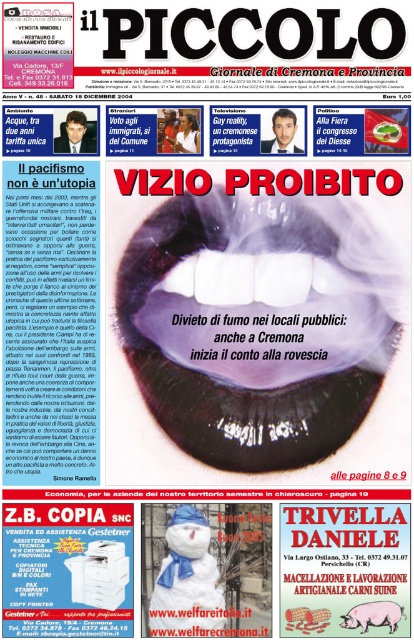
You are standing 1.5 meters away from the newspaper cover. You want to touch the point marked at coordinates point (336, 323). Can you reach it without moving closer?

The distance of point (336, 323) from viewer is 1.40 meters, so yes, you can reach it without moving closer since it is within your 1.5 meters reach.